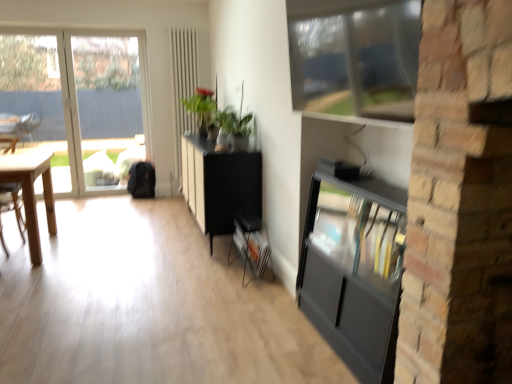
The width and height of the screenshot is (512, 384). I want to click on free space below metallic gray magazine rack at center (from a real-world perspective), so click(x=241, y=268).